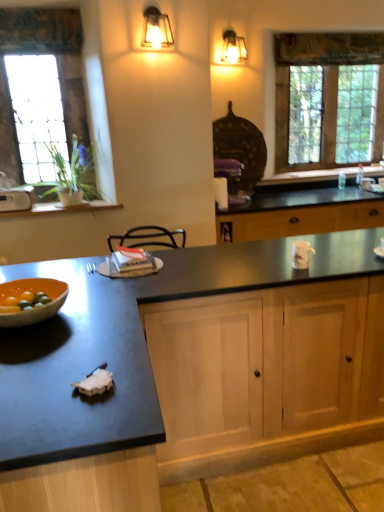
Question: Which direction should I rotate to look at metallic lantern at upper center, which is counted as the second light fixture, starting from the top, — up or down?

Choices:
 (A) up
 (B) down

Answer: (A)

Question: Is orange matte bowl at left at the back of metallic lantern at upper center, arranged as the 1th light fixture when ordered from the bottom?

Choices:
 (A) yes
 (B) no

Answer: (B)

Question: Is there a large distance between metallic lantern at upper center, arranged as the 1th light fixture when ordered from the bottom, and orange matte bowl at left?

Choices:
 (A) yes
 (B) no

Answer: (A)

Question: Can you confirm if metallic lantern at upper center, which is counted as the second light fixture, starting from the top, is taller than orange matte bowl at left?

Choices:
 (A) yes
 (B) no

Answer: (A)

Question: Considering the relative positions of metallic lantern at upper center, the second light fixture when ordered from right to left, and orange matte bowl at left in the image provided, is metallic lantern at upper center, the second light fixture when ordered from right to left, behind orange matte bowl at left?

Choices:
 (A) no
 (B) yes

Answer: (B)

Question: Is metallic lantern at upper center, acting as the 1th light fixture starting from the front, wider than orange matte bowl at left?

Choices:
 (A) no
 (B) yes

Answer: (A)

Question: Does metallic lantern at upper center, the second light fixture when ordered from back to front, have a lesser height compared to orange matte bowl at left?

Choices:
 (A) yes
 (B) no

Answer: (B)

Question: Is black granite countertop at center not close to metallic wall sconce at upper center, the first light fixture viewed from the back?

Choices:
 (A) no
 (B) yes

Answer: (B)

Question: Is black granite countertop at center facing away from metallic wall sconce at upper center, marked as the second light fixture in a bottom-to-top arrangement?

Choices:
 (A) yes
 (B) no

Answer: (B)

Question: From the image's perspective, is black granite countertop at center over metallic wall sconce at upper center, which appears as the 1th light fixture when viewed from the right?

Choices:
 (A) yes
 (B) no

Answer: (B)

Question: Can you confirm if black granite countertop at center is positioned to the left of metallic wall sconce at upper center, which is the 2th light fixture from front to back?

Choices:
 (A) yes
 (B) no

Answer: (A)

Question: Does black granite countertop at center come behind metallic wall sconce at upper center, the 2th light fixture when ordered from left to right?

Choices:
 (A) no
 (B) yes

Answer: (A)

Question: Does black granite countertop at center have a lesser height compared to metallic wall sconce at upper center, marked as the second light fixture in a bottom-to-top arrangement?

Choices:
 (A) no
 (B) yes

Answer: (A)

Question: Is orange matte bowl at left to the right of light wood cabinet at center from the viewer's perspective?

Choices:
 (A) yes
 (B) no

Answer: (B)